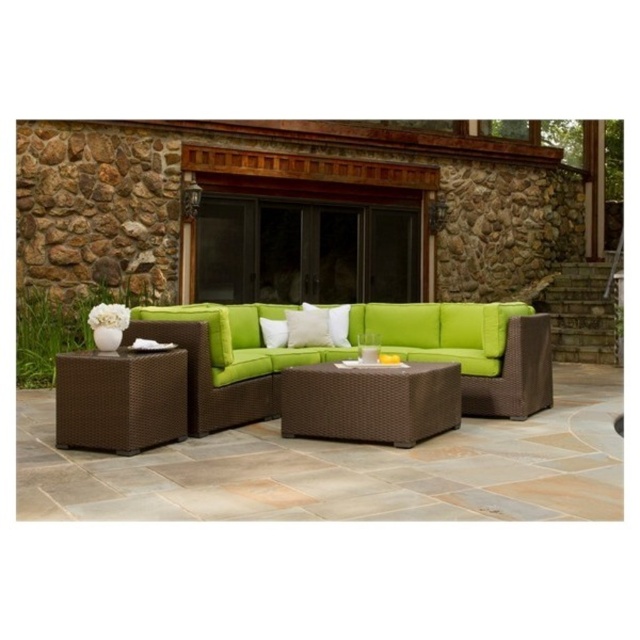
Is green woven couch at center closer to camera compared to brown wicker coffee table at center?

No.

Where is `green woven couch at center`? This screenshot has height=640, width=640. green woven couch at center is located at coordinates (355, 353).

Between point (163, 324) and point (115, 394), which one is positioned behind?

Point (163, 324)

Is point (536, 376) positioned behind point (157, 380)?

That is True.

The height and width of the screenshot is (640, 640). What are the coordinates of `green woven couch at center` in the screenshot? It's located at (355, 353).

Does green woven couch at center have a larger size compared to white soft cushion at center?

Indeed, green woven couch at center has a larger size compared to white soft cushion at center.

Between point (536, 371) and point (298, 339), which one is positioned in front?

Point (536, 371) is more forward.

The height and width of the screenshot is (640, 640). Identify the location of green woven couch at center. (355, 353).